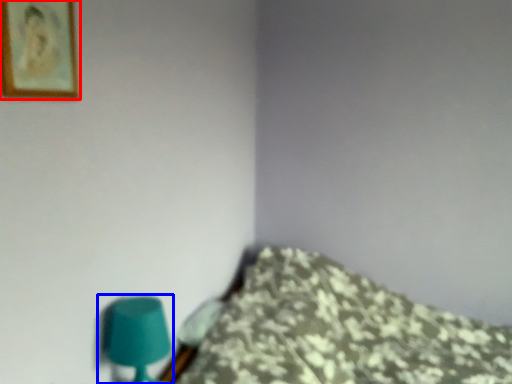
Question: Which object appears farthest to the camera in this image, picture frame (highlighted by a red box) or table lamp (highlighted by a blue box)?

Choices:
 (A) picture frame
 (B) table lamp

Answer: (B)